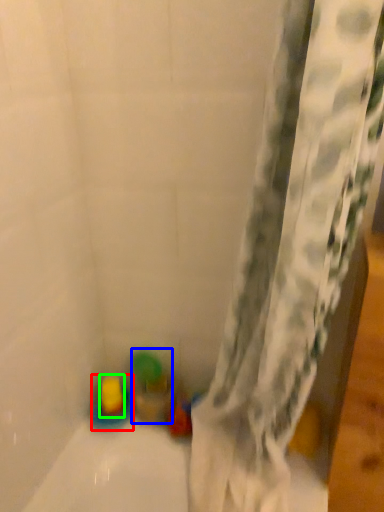
Question: Considering the real-world distances, which object is closest to toy (highlighted by a red box)? toy (highlighted by a blue box) or toy (highlighted by a green box).

Choices:
 (A) toy
 (B) toy

Answer: (B)